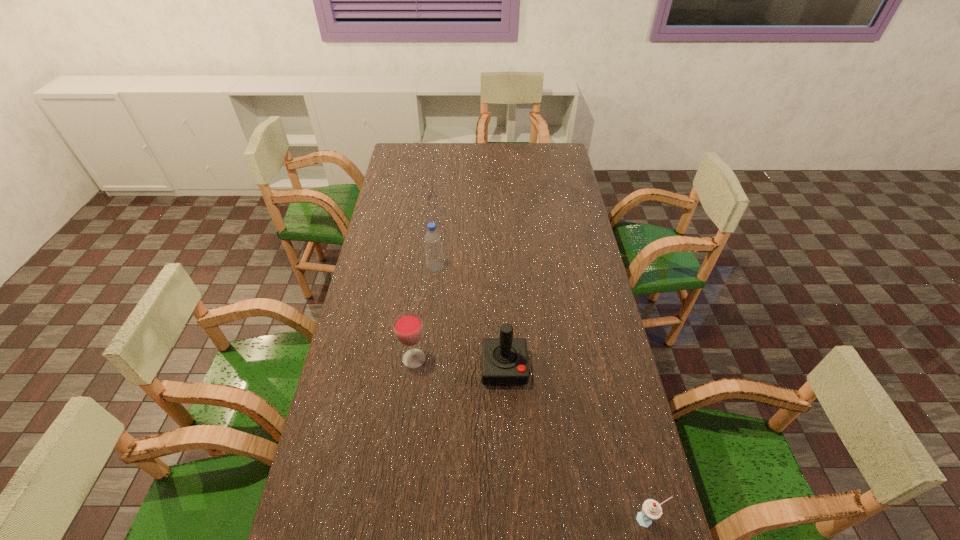
Where is `the farthest object`? the farthest object is located at coordinates (433, 247).

This screenshot has width=960, height=540. Identify the location of joystick. (504, 360).

The height and width of the screenshot is (540, 960). Identify the location of wineglass. (408, 327).

The image size is (960, 540). In order to click on the rightmost object in this screenshot , I will do `click(651, 510)`.

This screenshot has width=960, height=540. What are the coordinates of `the nearest object` in the screenshot? It's located at (651, 510).

Image resolution: width=960 pixels, height=540 pixels. In order to click on vacant space located on the front of the bottle in this screenshot , I will do coord(428,342).

You are a GUI agent. You are given a task and a screenshot of the screen. Output one action in this format:
    pyautogui.click(x=<x>, y=<y>)
    Task: Click on the blank space located on the base of the third object from left to right
    The width and height of the screenshot is (960, 540).
    Given the screenshot: What is the action you would take?
    pyautogui.click(x=509, y=474)

Where is `free point located 0.180m on the left of the wineglass`? free point located 0.180m on the left of the wineglass is located at coordinates (343, 359).

This screenshot has width=960, height=540. Find the location of `object that is at the right edge`. object that is at the right edge is located at coordinates (651, 510).

The height and width of the screenshot is (540, 960). I want to click on vacant space at the far edge, so click(x=437, y=165).